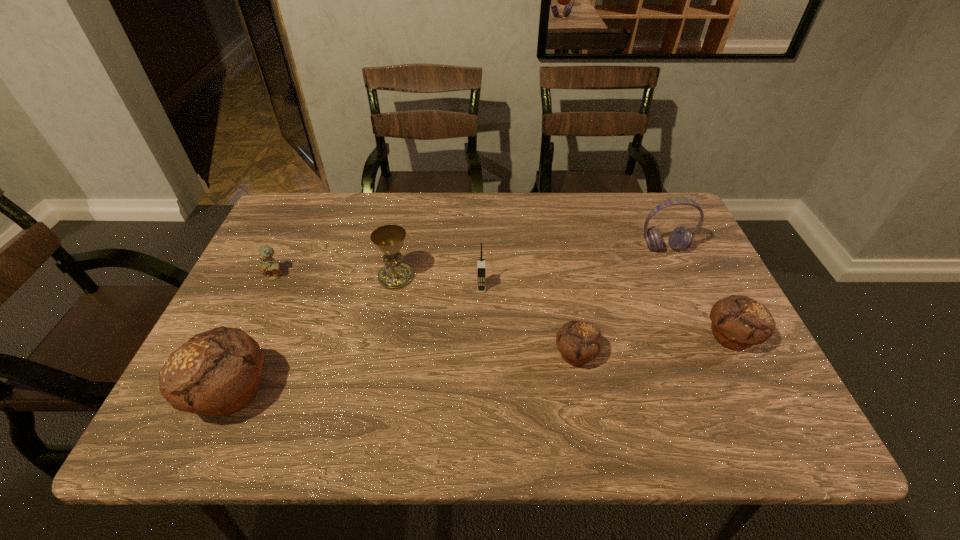
Locate an element on the screen. Image resolution: width=960 pixels, height=540 pixels. object present at the near left corner is located at coordinates (216, 373).

Locate an element on the screen. object situated at the far right corner is located at coordinates (681, 238).

The image size is (960, 540). What are the coordinates of `vacant space at the far edge of the desktop` in the screenshot? It's located at (409, 233).

The width and height of the screenshot is (960, 540). Identify the location of free space at the near edge. (370, 389).

Find the location of `vacant space at the right edge`. vacant space at the right edge is located at coordinates (710, 289).

I want to click on free space at the far right corner of the desktop, so click(632, 208).

At what (x,y) coordinates should I click in order to perform the action: click on empty location between the third object from left to right and the headset. Please return your answer as a coordinate pair (x, y). Image resolution: width=960 pixels, height=540 pixels. Looking at the image, I should click on (530, 263).

Image resolution: width=960 pixels, height=540 pixels. Identify the location of vacant space that's between the second muffin from right to left and the tallest muffin. (403, 374).

Locate an element on the screen. vacant area that lies between the third object from right to left and the chalice is located at coordinates (486, 316).

You are a GUI agent. You are given a task and a screenshot of the screen. Output one action in this format:
    pyautogui.click(x=<x>, y=<y>)
    Task: Click on the vacant region between the fourth object from right to left and the fifth object from right to left
    
    Given the screenshot: What is the action you would take?
    tap(439, 283)